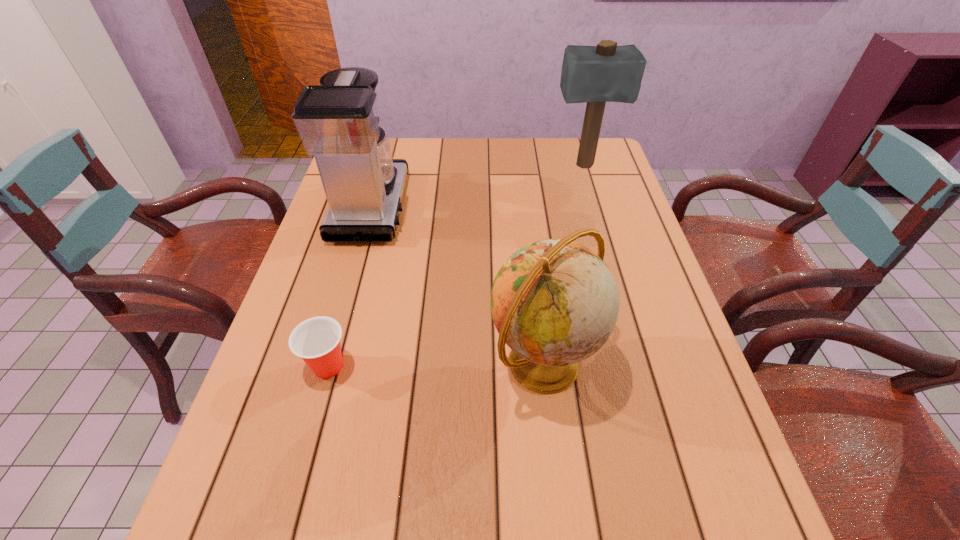
Where is `mallet`? mallet is located at coordinates (604, 73).

Where is `coffee maker`? coffee maker is located at coordinates (338, 123).

Identify the location of globe. The image size is (960, 540). (554, 302).

Identify the location of cup. 316,340.

Where is `vacant space located 0.240m on the left of the mallet`? vacant space located 0.240m on the left of the mallet is located at coordinates (478, 166).

I want to click on vacant space located 0.310m at the front of the coffee maker where the controls are located, so click(x=514, y=207).

You are a GUI agent. You are given a task and a screenshot of the screen. Output one action in this format:
    pyautogui.click(x=<x>, y=<y>)
    Task: Click on the free space located on the left of the globe
    The image size is (960, 540).
    Given the screenshot: What is the action you would take?
    tap(441, 365)

Where is `vacant region located 0.210m on the right of the cup`? vacant region located 0.210m on the right of the cup is located at coordinates (455, 366).

Where is `mallet that is at the far edge`? Image resolution: width=960 pixels, height=540 pixels. mallet that is at the far edge is located at coordinates (604, 73).

You are a GUI agent. You are given a task and a screenshot of the screen. Output one action in this format:
    pyautogui.click(x=<x>, y=<y>)
    Task: Click on the coffee maker located in the far edge section of the desktop
    The image size is (960, 540).
    Given the screenshot: What is the action you would take?
    pyautogui.click(x=338, y=123)